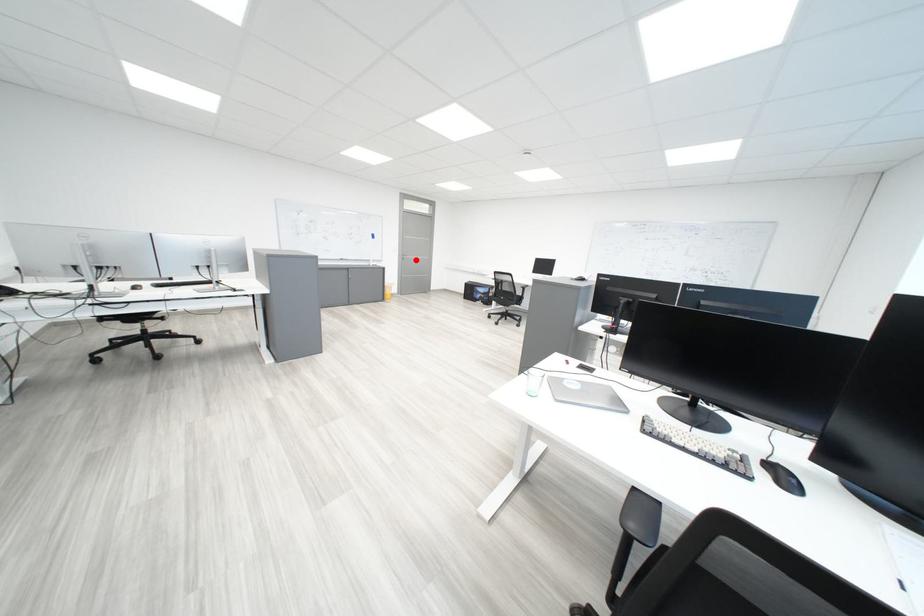
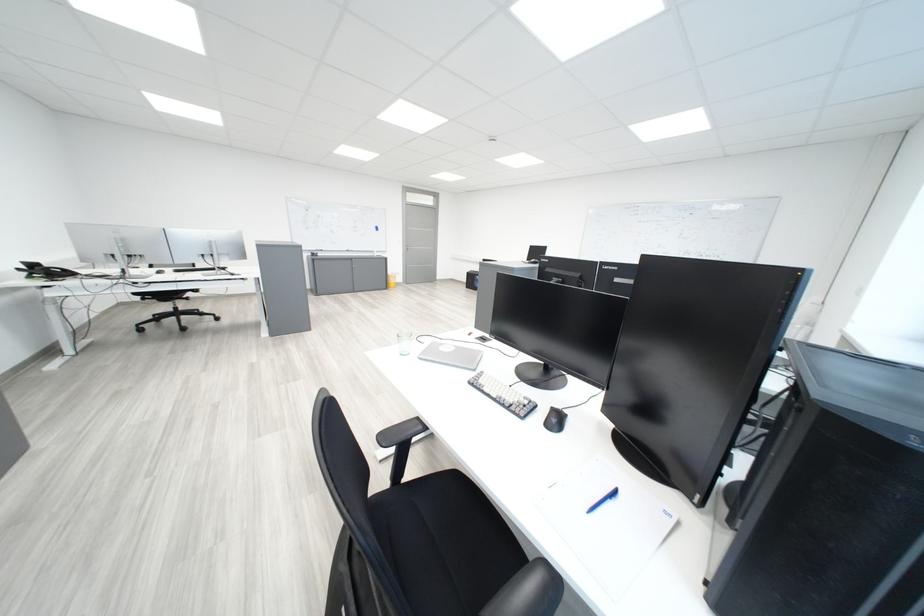
The point at the highlighted location is marked in the first image. Where is the corresponding point in the second image?

(419, 251)